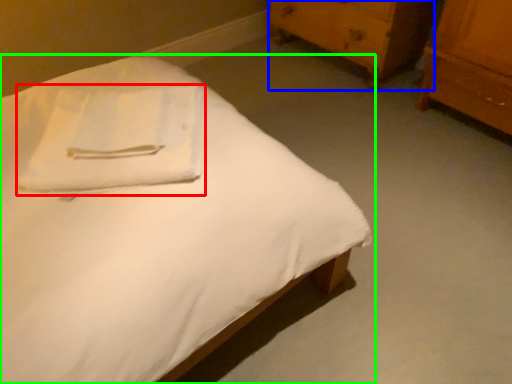
Question: Based on their relative distances, which object is farther from cloth (highlighted by a red box)? Choose from chest of drawers (highlighted by a blue box) and bed (highlighted by a green box).

Choices:
 (A) chest of drawers
 (B) bed

Answer: (A)